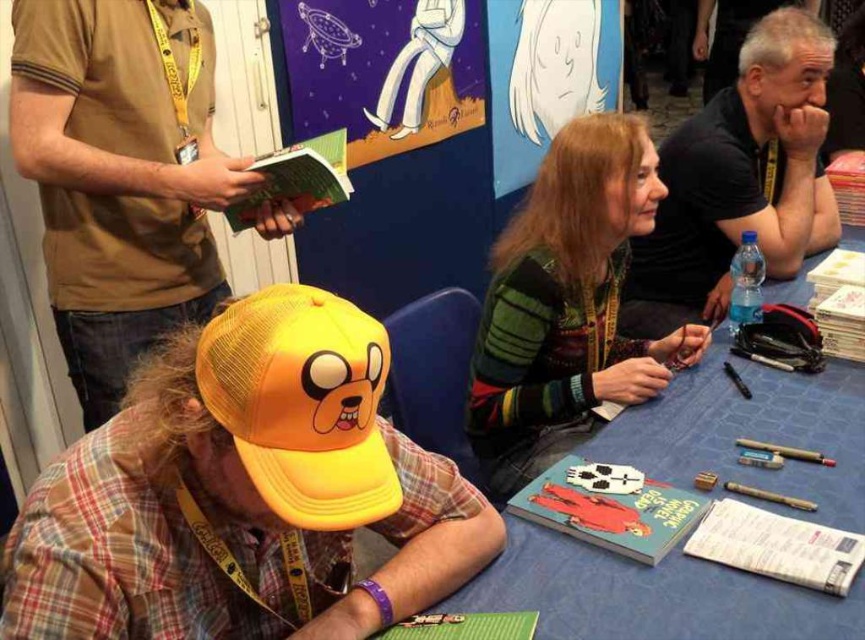
Question: Which point is closer to the camera?

Choices:
 (A) matte plastic book at center
 (B) green striped sweater at center
 (C) yellow mesh baseball cap at center
 (D) yellow mesh cap at lower left

Answer: (C)

Question: Is yellow mesh cap at lower left bigger than blue fabric table at center?

Choices:
 (A) no
 (B) yes

Answer: (A)

Question: Can you confirm if yellow mesh cap at center is positioned above yellow mesh cap at lower left?

Choices:
 (A) no
 (B) yes

Answer: (A)

Question: Is black mesh cap at upper right positioned behind yellow mesh baseball cap at center?

Choices:
 (A) yes
 (B) no

Answer: (A)

Question: Which of the following is the closest to the observer?

Choices:
 (A) (69, 323)
 (B) (530, 358)
 (C) (695, 499)

Answer: (C)

Question: Which point is closer to the camera?

Choices:
 (A) yellow mesh baseball cap at center
 (B) blue fabric table at center

Answer: (A)